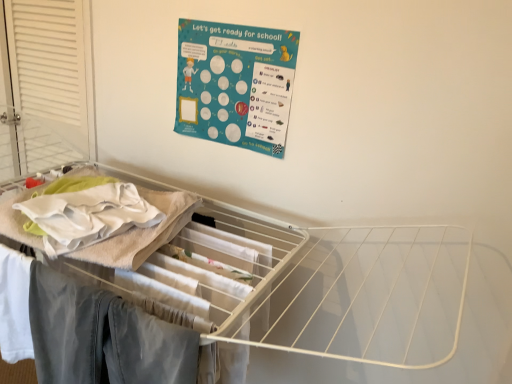
What do you see at coordinates (46, 84) in the screenshot?
I see `white louvered screen door at left` at bounding box center [46, 84].

The image size is (512, 384). I want to click on denim pants at lower left, so click(103, 336).

The height and width of the screenshot is (384, 512). Identify the location of teal paperboard poster at upper center. (234, 84).

The image size is (512, 384). What are the coordinates of `white wire drying rack at upper center` in the screenshot? It's located at (298, 285).

From the image's perspective, would you say white louvered screen door at left is shown under teal paperboard poster at upper center?

Incorrect, from the image's perspective, white louvered screen door at left is higher than teal paperboard poster at upper center.

Is point (89, 156) farther from viewer compared to point (240, 61)?

Yes, point (89, 156) is behind point (240, 61).

Would you say white louvered screen door at left is a long distance from teal paperboard poster at upper center?

They are positioned close to each other.

Is white louvered screen door at left in front of or behind teal paperboard poster at upper center in the image?

In the image, white louvered screen door at left appears behind teal paperboard poster at upper center.

From their relative heights in the image, would you say white louvered screen door at left is taller or shorter than white wire drying rack at upper center?

In the image, white louvered screen door at left appears to be shorter than white wire drying rack at upper center.

Can you confirm if white louvered screen door at left is positioned to the right of white wire drying rack at upper center?

In fact, white louvered screen door at left is to the left of white wire drying rack at upper center.

Which object is wider, white louvered screen door at left or white wire drying rack at upper center?

white wire drying rack at upper center is wider.

Could white wire drying rack at upper center be considered to be inside white louvered screen door at left?

No, white louvered screen door at left does not contain white wire drying rack at upper center.

Considering the relative sizes of teal paperboard poster at upper center and denim pants at lower left in the image provided, is teal paperboard poster at upper center bigger than denim pants at lower left?

No.

I want to click on poster behind the denim pants at lower left, so click(234, 84).

From the image's perspective, is teal paperboard poster at upper center above or below denim pants at lower left?

teal paperboard poster at upper center is situated higher than denim pants at lower left in the image.

Is teal paperboard poster at upper center not near denim pants at lower left?

→ No, teal paperboard poster at upper center is in close proximity to denim pants at lower left.

Is teal paperboard poster at upper center oriented away from white louvered screen door at left?

No.

Is teal paperboard poster at upper center wider than white louvered screen door at left?

No, teal paperboard poster at upper center is not wider than white louvered screen door at left.

Does point (269, 122) lie behind point (89, 49)?

No, (269, 122) is closer to viewer.

Is teal paperboard poster at upper center to the right of white louvered screen door at left from the viewer's perspective?

Indeed, teal paperboard poster at upper center is positioned on the right side of white louvered screen door at left.

Which is behind, point (398, 365) or point (136, 312)?

The point (398, 365) is more distant.

Is white wire drying rack at upper center aimed at denim pants at lower left?

Yes.

Is white wire drying rack at upper center directly adjacent to denim pants at lower left?

No.

Visually, is white wire drying rack at upper center positioned to the left or to the right of denim pants at lower left?

white wire drying rack at upper center is to the left of denim pants at lower left.

Identify the location of screen door that appears above the denim pants at lower left (from a real-world perspective). This screenshot has width=512, height=384. (46, 84).

Based on the photo, considering the sizes of denim pants at lower left and white louvered screen door at left in the image, is denim pants at lower left bigger or smaller than white louvered screen door at left?

In the image, denim pants at lower left appears to be smaller than white louvered screen door at left.

From a real-world perspective, is denim pants at lower left physically below white louvered screen door at left?

Yes.

From the image's perspective, which one is positioned higher, white wire drying rack at upper center or white louvered screen door at left?

From the image's view, white louvered screen door at left is above.

Considering the relative sizes of white wire drying rack at upper center and white louvered screen door at left in the image provided, is white wire drying rack at upper center shorter than white louvered screen door at left?

Incorrect, the height of white wire drying rack at upper center does not fall short of that of white louvered screen door at left.

Which object is more forward, white wire drying rack at upper center or white louvered screen door at left?

Positioned in front is white wire drying rack at upper center.

This screenshot has height=384, width=512. I want to click on screen door on the left of teal paperboard poster at upper center, so click(x=46, y=84).

Where is `screen door above the white wire drying rack at upper center (from the image's perspective)`? This screenshot has width=512, height=384. screen door above the white wire drying rack at upper center (from the image's perspective) is located at coordinates (46, 84).

Estimate the real-world distances between objects in this image. Which object is closer to teal paperboard poster at upper center, white louvered screen door at left or white wire drying rack at upper center?

white wire drying rack at upper center lies closer to teal paperboard poster at upper center than the other object.

Considering their positions, is white louvered screen door at left positioned further to denim pants at lower left than teal paperboard poster at upper center?

white louvered screen door at left lies further to denim pants at lower left than the other object.

Considering their positions, is denim pants at lower left positioned closer to teal paperboard poster at upper center than white wire drying rack at upper center?

Based on the image, white wire drying rack at upper center appears to be nearer to teal paperboard poster at upper center.

Which object lies nearer to the anchor point white louvered screen door at left, white wire drying rack at upper center or teal paperboard poster at upper center?

teal paperboard poster at upper center is closer to white louvered screen door at left.

In the scene shown: Based on their spatial positions, is white wire drying rack at upper center or white louvered screen door at left closer to teal paperboard poster at upper center?

The object closer to teal paperboard poster at upper center is white wire drying rack at upper center.

Estimate the real-world distances between objects in this image. Which object is closer to teal paperboard poster at upper center, white wire drying rack at upper center or denim pants at lower left?

Among the two, white wire drying rack at upper center is located nearer to teal paperboard poster at upper center.

Estimate the real-world distances between objects in this image. Which object is closer to white wire drying rack at upper center, white louvered screen door at left or denim pants at lower left?

denim pants at lower left lies closer to white wire drying rack at upper center than the other object.

From the image, which object appears to be nearer to denim pants at lower left, teal paperboard poster at upper center or white louvered screen door at left?

teal paperboard poster at upper center lies closer to denim pants at lower left than the other object.

You are a GUI agent. You are given a task and a screenshot of the screen. Output one action in this format:
    pyautogui.click(x=<x>, y=<y>)
    Task: Click on the furniture between teal paperboard poster at upper center and denim pants at lower left from top to bottom
    The height and width of the screenshot is (384, 512).
    Given the screenshot: What is the action you would take?
    pyautogui.click(x=298, y=285)

Where is `clothing located between white wire drying rack at upper center and white louvered screen door at left in the depth direction`? The width and height of the screenshot is (512, 384). clothing located between white wire drying rack at upper center and white louvered screen door at left in the depth direction is located at coordinates (103, 336).

You are a GUI agent. You are given a task and a screenshot of the screen. Output one action in this format:
    pyautogui.click(x=<x>, y=<y>)
    Task: Click on the poster between white wire drying rack at upper center and white louvered screen door at left along the z-axis
    The image size is (512, 384).
    Given the screenshot: What is the action you would take?
    pyautogui.click(x=234, y=84)

Find the location of a particular element. This screenshot has width=512, height=384. poster between white louvered screen door at left and denim pants at lower left from top to bottom is located at coordinates (234, 84).